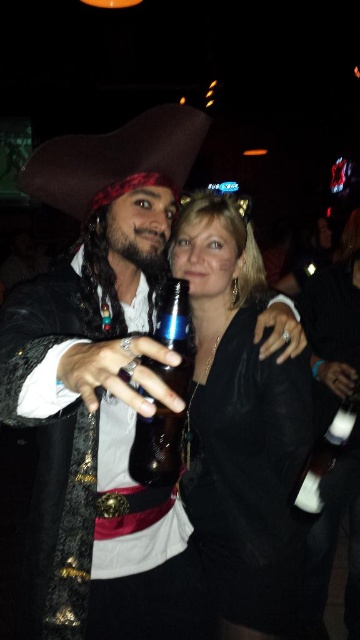
Who is higher up, matte black pirate hat at upper left or shiny metallic bottle at center?

shiny metallic bottle at center is above.

Based on the photo, measure the distance between point (91, 483) and camera.

They are 1.15 meters apart.

Where is `matte black pirate hat at upper left`? matte black pirate hat at upper left is located at coordinates (101, 390).

Identify the location of matte black pirate hat at upper left. This screenshot has height=640, width=360. (101, 390).

Which is in front, point (280, 496) or point (186, 317)?

Positioned in front is point (186, 317).

Where is `black velvet dress at center`? The image size is (360, 640). black velvet dress at center is located at coordinates (240, 420).

Between point (225, 236) and point (181, 285), which one is positioned behind?

The point (225, 236) is behind.

The width and height of the screenshot is (360, 640). I want to click on black velvet dress at center, so click(x=240, y=420).

Who is lower down, matte black pirate hat at upper left or black velvet dress at center?

black velvet dress at center

Between point (187, 620) and point (217, 326), which one is positioned in front?

Point (187, 620) is more forward.

Find the location of a particular element. This screenshot has height=640, width=360. matte black pirate hat at upper left is located at coordinates (101, 390).